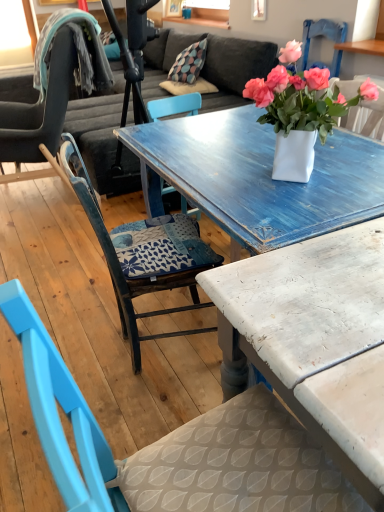
Question: From a real-world perspective, is blue painted wood chair at center, acting as the third chair starting from the left, on matte blue chair at left, marked as the 3th chair in a right-to-left arrangement?

Choices:
 (A) yes
 (B) no

Answer: (B)

Question: From the image's perspective, is blue painted wood chair at center, positioned as the 3th chair in back-to-front order, beneath matte blue chair at left, the first chair viewed from the back?

Choices:
 (A) no
 (B) yes

Answer: (B)

Question: Is blue painted wood chair at center, which is counted as the 1th chair, starting from the front, bigger than matte blue chair at left, marked as the 3th chair in a right-to-left arrangement?

Choices:
 (A) no
 (B) yes

Answer: (A)

Question: Is blue painted wood chair at center, acting as the third chair starting from the left, further to camera compared to matte blue chair at left, marked as the 3th chair in a right-to-left arrangement?

Choices:
 (A) no
 (B) yes

Answer: (A)

Question: Is the surface of blue painted wood chair at center, which is counted as the 1th chair, starting from the front, in direct contact with matte blue chair at left, which appears as the 1th chair when viewed from the left?

Choices:
 (A) no
 (B) yes

Answer: (A)

Question: In the image, is distressed white table at center positioned in front of or behind blue painted wood chair at center, the second chair viewed from the left?

Choices:
 (A) front
 (B) behind

Answer: (A)

Question: From the image's perspective, is distressed white table at center above or below blue painted wood chair at center, the second chair viewed from the left?

Choices:
 (A) below
 (B) above

Answer: (A)

Question: Is point [382, 236] closer or farther from the camera than point [152, 219]?

Choices:
 (A) farther
 (B) closer

Answer: (B)

Question: Do you think distressed white table at center is within blue painted wood chair at center, the second chair viewed from the left, or outside of it?

Choices:
 (A) inside
 (B) outside

Answer: (B)

Question: Is white matte vase at center inside or outside of matte blue chair at left, which is counted as the 3th chair, starting from the front?

Choices:
 (A) inside
 (B) outside

Answer: (B)

Question: Is white matte vase at center wider or thinner than matte blue chair at left, the first chair viewed from the back?

Choices:
 (A) thin
 (B) wide

Answer: (A)

Question: Considering the relative positions of white matte vase at center and matte blue chair at left, marked as the 3th chair in a right-to-left arrangement, in the image provided, is white matte vase at center to the left or to the right of matte blue chair at left, marked as the 3th chair in a right-to-left arrangement,?

Choices:
 (A) right
 (B) left

Answer: (A)

Question: From a real-world perspective, is white matte vase at center above or below matte blue chair at left, marked as the 3th chair in a right-to-left arrangement?

Choices:
 (A) above
 (B) below

Answer: (A)

Question: Is blue painted wood chair at center, acting as the 2th chair starting from the front, inside the boundaries of distressed white table at center, or outside?

Choices:
 (A) inside
 (B) outside

Answer: (B)

Question: Relative to distressed white table at center, is blue painted wood chair at center, acting as the 2th chair starting from the front, in front or behind?

Choices:
 (A) front
 (B) behind

Answer: (B)